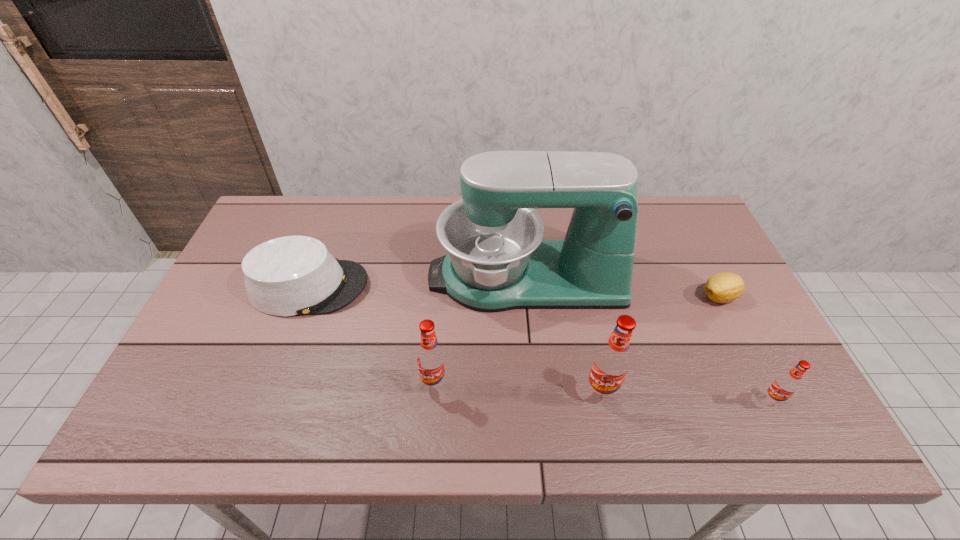
I want to click on free space between the lemon and the second tallest root beer, so click(x=577, y=341).

Locate an element on the screen. vacant point located between the mixer and the hat is located at coordinates click(x=418, y=282).

Identify the location of vacant area that lies between the hat and the second root beer from left to right. coord(455,340).

What are the coordinates of `vacant area between the hat and the second root beer from right to left` in the screenshot? It's located at (455, 340).

Locate an element on the screen. The image size is (960, 540). free space between the rightmost root beer and the second root beer from right to left is located at coordinates (686, 396).

Locate an element on the screen. This screenshot has height=540, width=960. free space that is in between the second root beer from left to right and the shortest object is located at coordinates (660, 345).

In order to click on vacant point located between the hat and the shortest root beer in this screenshot , I will do `click(540, 343)`.

What are the coordinates of `object that is the second nearest to the shortest root beer` in the screenshot? It's located at (497, 260).

Identify the location of the third closest object to the tallest object. The height and width of the screenshot is (540, 960). (612, 361).

Point out which root beer is positioned as the second nearest to the hat. Please provide its 2D coordinates. Your answer should be formatted as a tuple, i.e. [(x, y)], where the tuple contains the x and y coordinates of a point satisfying the conditions above.

[(612, 361)]